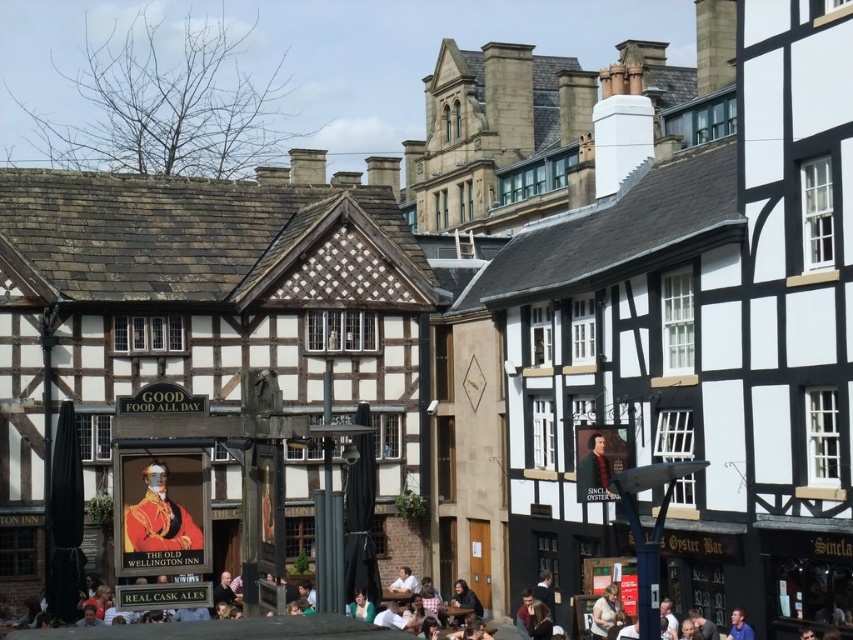
You are standing at the entrance of the historic town square and notice a person wearing white casual clothing at lower center. Where exactly is this person positioned relative to the wooden archway with the sign?

The white casual clothing at lower center is located at point 0.984 on the x axis and 0.271 on the y axis relative to the wooden archway with the sign.

You are a fashion designer observing a crowd in the historic town square. You notice two people wearing white casual clothing at lower center and light brown leather jacket at lower center. Which of these two items is wider?

The white casual clothing at lower center is wider than the light brown leather jacket at lower center according to the description.

You are standing in the historic town square and want to take a photo of both the wooden archway with the sign and the poster for THE OLD WELLINGTON INN. You notice two points marked on your map at coordinates point (596, 468) and point (596, 621). Which point should you stand at to ensure both objects are in your camera frame?

You should stand at point (596, 468) because it is closer to the camera, allowing both the wooden archway with the sign and the poster for THE OLD WELLINGTON INN to be in frame.